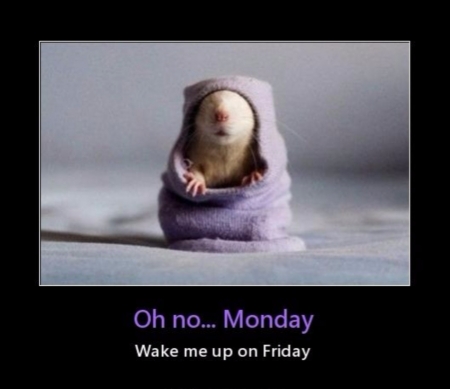
Where is `purple sheet`? The image size is (450, 389). purple sheet is located at coordinates (268, 220).